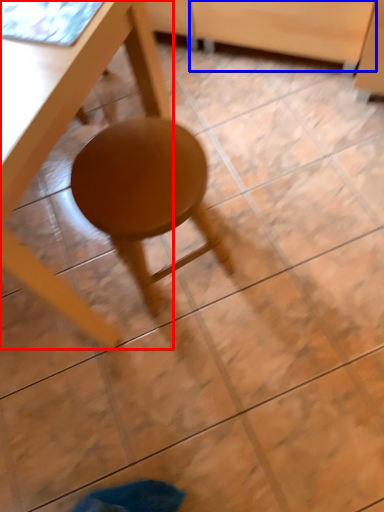
Question: Which of the following is the closest to the observer, table (highlighted by a red box) or drawer (highlighted by a blue box)?

Choices:
 (A) table
 (B) drawer

Answer: (A)